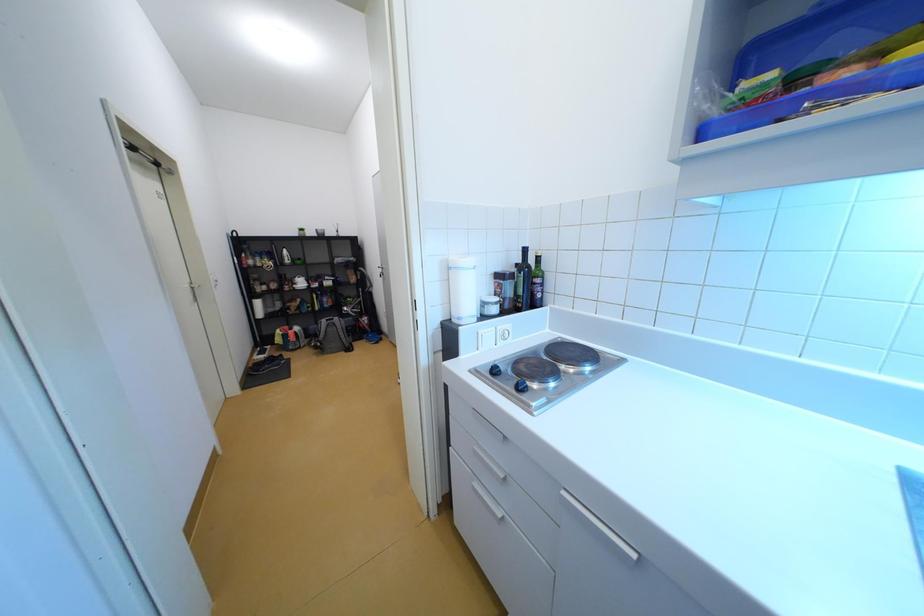
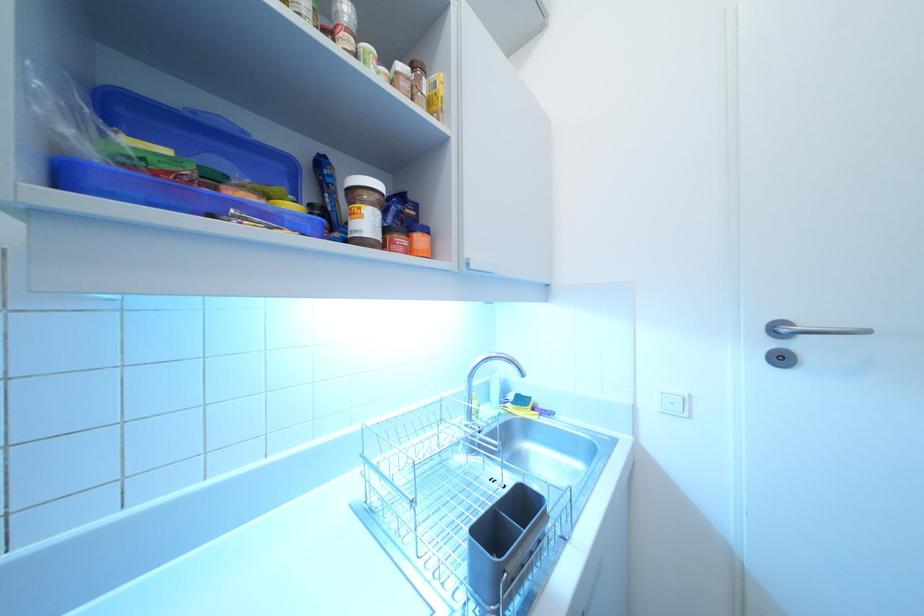
Question: Based on the continuous images, in which direction is the camera rotating? Reply with the corresponding letter.

Choices:
 (A) Left
 (B) Right
 (C) Up
 (D) Down

Answer: (B)